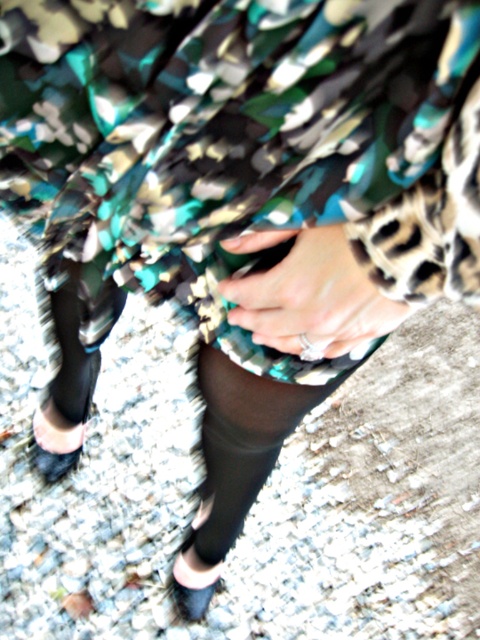
You are taking a photo of a person wearing dark shoes with pink accents. You notice two points on their outfit at coordinates point (x=240, y=461) and point (x=69, y=468). Which point is nearer to the camera?

Point (x=240, y=461) is closer to the camera than point (x=69, y=468).

You are a fashion designer observing the image. You need to determine the spatial relationship between the black sheer sock at lower center and the black leather shoe at lower left. Which one is positioned higher?

The black sheer sock at lower center is positioned higher than the black leather shoe at lower left.

You are a fashion designer analyzing the placement of two points on a model for a new clothing line. The points are labeled as point (60, 417) and point (199, 604). Based on the image provided, which point is positioned further away from the viewer?

Point (60, 417) is behind point (199, 604), so it is positioned further away from the viewer.